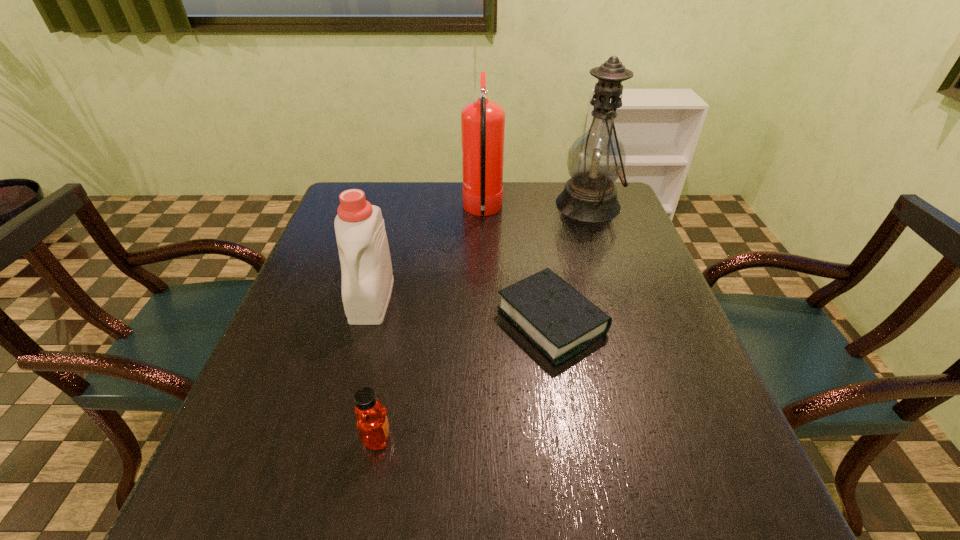
This screenshot has height=540, width=960. What are the coordinates of `oil lamp` in the screenshot? It's located at (596, 159).

Where is `fire extinguisher`? The height and width of the screenshot is (540, 960). fire extinguisher is located at coordinates (482, 122).

The width and height of the screenshot is (960, 540). Find the location of `detergent`. detergent is located at coordinates tap(367, 278).

This screenshot has width=960, height=540. In order to click on the third tallest object in this screenshot , I will do `click(367, 278)`.

Where is `the fourth object from right to left`? The image size is (960, 540). the fourth object from right to left is located at coordinates (372, 424).

In order to click on the second shortest object in this screenshot , I will do `click(372, 424)`.

This screenshot has width=960, height=540. In order to click on Bible in this screenshot , I will do `click(553, 315)`.

Image resolution: width=960 pixels, height=540 pixels. I want to click on free space located 0.100m on the left of the oil lamp, so click(x=523, y=204).

Locate an element on the screen. This screenshot has width=960, height=540. vacant region located towards the nozzle of the fire extinguisher is located at coordinates (365, 212).

At what (x,y) coordinates should I click in order to perform the action: click on vacant area situated towards the nozzle of the fire extinguisher. Please return your answer as a coordinate pair (x, y). Looking at the image, I should click on (405, 212).